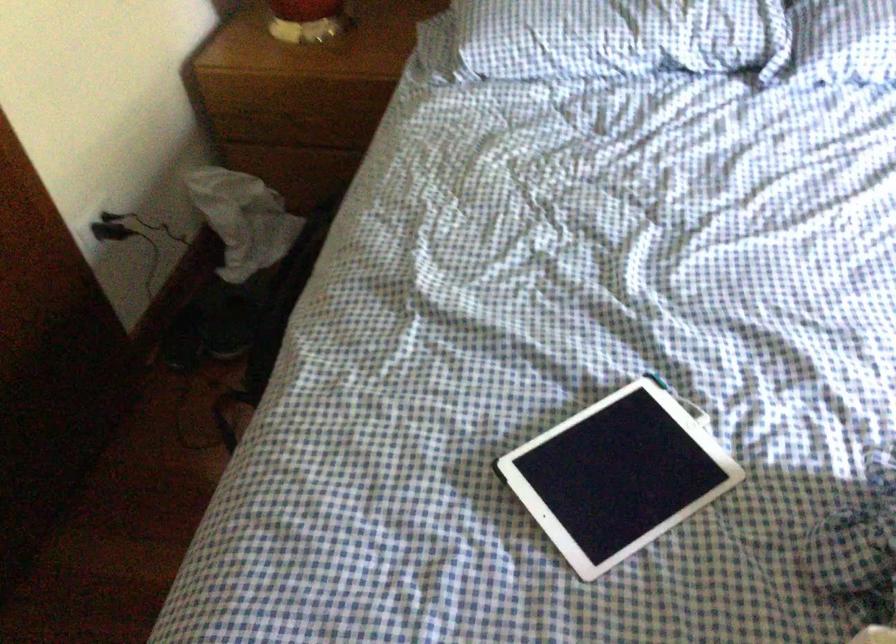
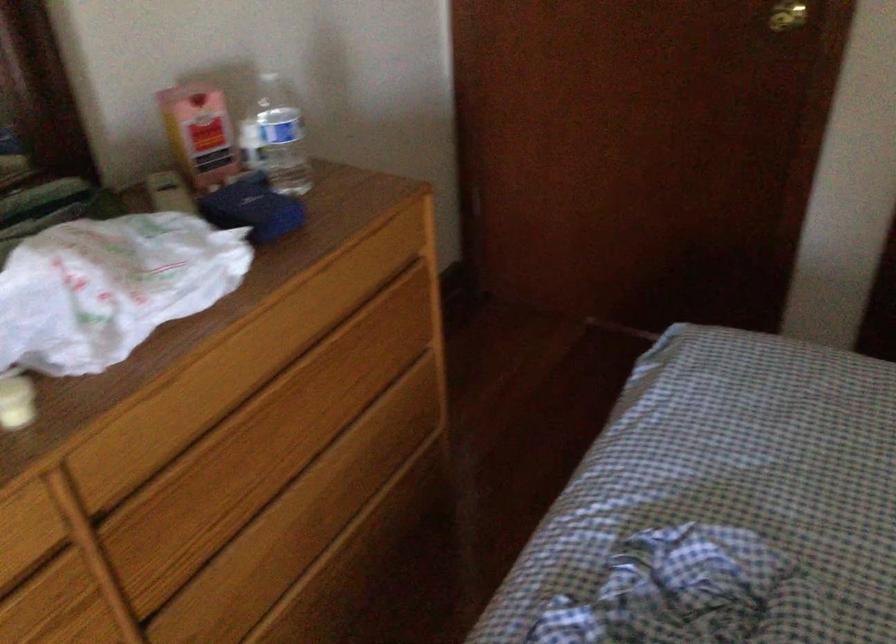
The first image is from the beginning of the video and the second image is from the end. How did the camera likely rotate when shooting the video?

The camera's rotation is toward left-down.